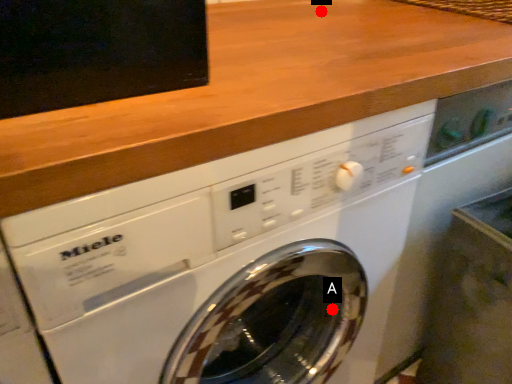
Question: Two points are circled on the image, labeled by A and B beside each circle. Among these points, which one is nearest to the camera?

Choices:
 (A) A is closer
 (B) B is closer

Answer: (A)